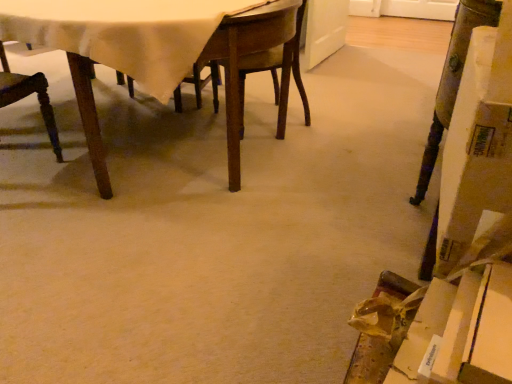
Question: Should I look upward or downward to see wooden chair at left?

Choices:
 (A) down
 (B) up

Answer: (B)

Question: From the image's perspective, is wooden chair at left above wooden table at center?

Choices:
 (A) no
 (B) yes

Answer: (A)

Question: From a real-world perspective, is wooden chair at left on wooden table at center?

Choices:
 (A) yes
 (B) no

Answer: (B)

Question: Can you confirm if wooden chair at left is thinner than wooden table at center?

Choices:
 (A) yes
 (B) no

Answer: (A)

Question: Is wooden chair at left placed right next to wooden table at center?

Choices:
 (A) yes
 (B) no

Answer: (B)

Question: Considering the relative sizes of wooden chair at left and wooden table at center in the image provided, is wooden chair at left bigger than wooden table at center?

Choices:
 (A) yes
 (B) no

Answer: (B)

Question: Does wooden chair at left come in front of wooden table at center?

Choices:
 (A) yes
 (B) no

Answer: (B)

Question: Considering the relative positions of wooden table at center and wooden chair at left in the image provided, is wooden table at center behind wooden chair at left?

Choices:
 (A) yes
 (B) no

Answer: (B)

Question: Does wooden table at center have a smaller size compared to wooden chair at left?

Choices:
 (A) yes
 (B) no

Answer: (B)

Question: Considering the relative sizes of wooden table at center and wooden chair at left in the image provided, is wooden table at center wider than wooden chair at left?

Choices:
 (A) no
 (B) yes

Answer: (B)

Question: From a real-world perspective, is wooden table at center physically below wooden chair at left?

Choices:
 (A) yes
 (B) no

Answer: (B)

Question: Would you say wooden table at center contains wooden chair at left?

Choices:
 (A) yes
 (B) no

Answer: (A)

Question: Does wooden table at center turn towards wooden chair at left?

Choices:
 (A) yes
 (B) no

Answer: (A)

Question: In the image, is wooden table at center positioned in front of or behind wooden chair at left?

Choices:
 (A) front
 (B) behind

Answer: (A)